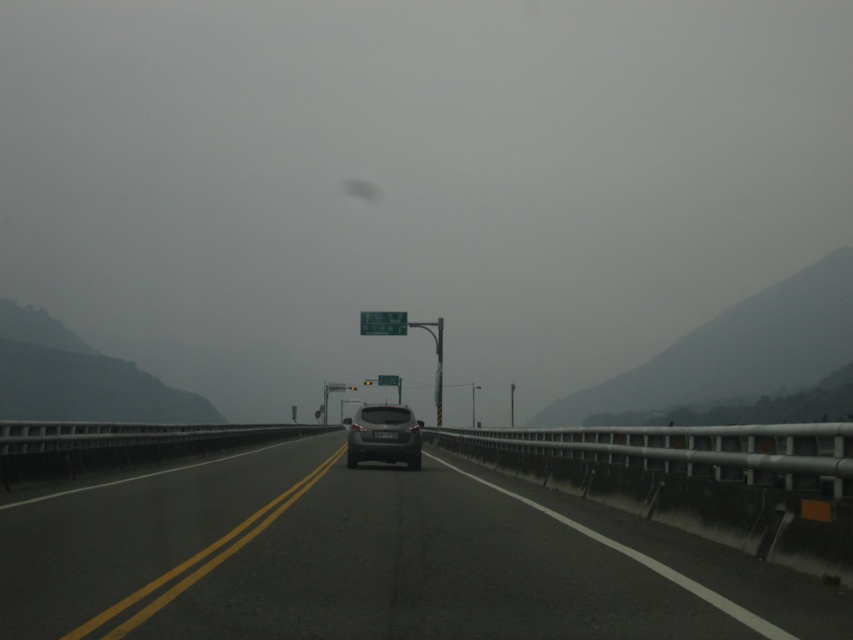
Question: Does gray matte fog at right have a larger size compared to green plastic sign at center?

Choices:
 (A) yes
 (B) no

Answer: (A)

Question: Which object is positioned closest to the satin black suv at center?

Choices:
 (A) transparent glass windshield at center
 (B) green plastic sign at center
 (C) green plastic street sign at center
 (D) smooth asphalt highway at center

Answer: (D)

Question: Considering the real-world distances, which object is farthest from the satin black suv at center?

Choices:
 (A) transparent glass windshield at center
 (B) green plastic sign at center
 (C) gray matte fog at right

Answer: (A)

Question: Does transparent glass windshield at center appear on the left side of gray matte fog at right?

Choices:
 (A) yes
 (B) no

Answer: (A)

Question: Considering the real-world distances, which object is farthest from the green plastic sign at center?

Choices:
 (A) gray matte fog at right
 (B) satin black suv at center
 (C) transparent glass windshield at center

Answer: (C)

Question: Can you confirm if satin black suv at center is positioned to the right of green plastic sign at center?

Choices:
 (A) yes
 (B) no

Answer: (A)